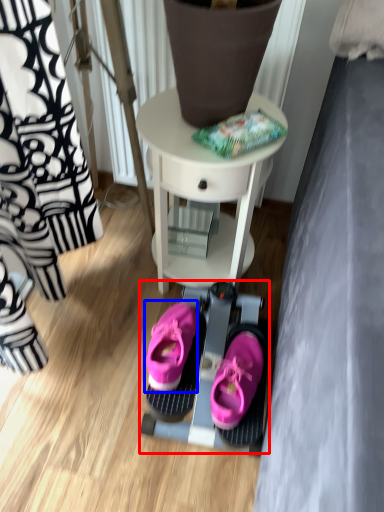
Question: Which object is closer to the camera taking this photo, bunk bed (highlighted by a red box) or footwear (highlighted by a blue box)?

Choices:
 (A) bunk bed
 (B) footwear

Answer: (B)